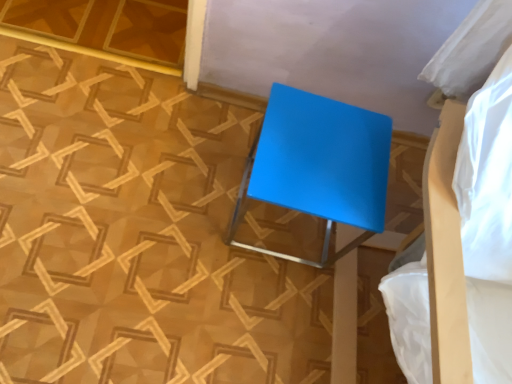
The height and width of the screenshot is (384, 512). Describe the element at coordinates (317, 168) in the screenshot. I see `blue glossy stool at center` at that location.

Locate an element on the screen. blue glossy stool at center is located at coordinates click(x=317, y=168).

This screenshot has height=384, width=512. What do you see at coordinates (484, 177) in the screenshot? I see `matte blue bed at upper right` at bounding box center [484, 177].

In order to click on matte blue bed at upper right in this screenshot , I will do `click(484, 177)`.

You are a GUI agent. You are given a task and a screenshot of the screen. Output one action in this format:
    pyautogui.click(x=<x>, y=<y>)
    Task: Click on the blue glossy stool at center
    The image size is (512, 384).
    Given the screenshot: What is the action you would take?
    pyautogui.click(x=317, y=168)

Would you say matte blue bed at upper right is to the left or to the right of blue glossy stool at center in the picture?

Based on their positions, matte blue bed at upper right is located to the right of blue glossy stool at center.

Looking at this image, is matte blue bed at upper right positioned behind blue glossy stool at center?

No, matte blue bed at upper right is in front of blue glossy stool at center.

Does point (488, 275) appear closer or farther from the camera than point (305, 210)?

Point (488, 275).

From the image's perspective, does matte blue bed at upper right appear lower than blue glossy stool at center?

Yes, from the image's perspective, matte blue bed at upper right is beneath blue glossy stool at center.

From a real-world perspective, is matte blue bed at upper right positioned under blue glossy stool at center based on gravity?

No, from a real-world perspective, matte blue bed at upper right is not under blue glossy stool at center.

Considering the sizes of matte blue bed at upper right and blue glossy stool at center in the image, is matte blue bed at upper right wider or thinner than blue glossy stool at center?

Clearly, matte blue bed at upper right has more width compared to blue glossy stool at center.

From their relative heights in the image, would you say matte blue bed at upper right is taller or shorter than blue glossy stool at center?

In the image, matte blue bed at upper right appears to be taller than blue glossy stool at center.

Looking at the image, does matte blue bed at upper right seem bigger or smaller compared to blue glossy stool at center?

Considering their sizes, matte blue bed at upper right takes up more space than blue glossy stool at center.

Choose the correct answer: Is matte blue bed at upper right inside blue glossy stool at center or outside it?

matte blue bed at upper right exists outside the volume of blue glossy stool at center.

Is matte blue bed at upper right far from blue glossy stool at center?

No, there isn't a large distance between matte blue bed at upper right and blue glossy stool at center.

Is matte blue bed at upper right turned away from blue glossy stool at center?

That's not correct — matte blue bed at upper right is not looking away from blue glossy stool at center.

How many degrees apart are the facing directions of matte blue bed at upper right and blue glossy stool at center?

They differ by 1.98 degrees in their facing directions.

How far apart are matte blue bed at upper right and blue glossy stool at center?

matte blue bed at upper right is 9.59 inches away from blue glossy stool at center.

Image resolution: width=512 pixels, height=384 pixels. In order to click on furniture on the left of the matte blue bed at upper right in this screenshot , I will do `click(317, 168)`.

Considering the relative positions of blue glossy stool at center and matte blue bed at upper right in the image provided, is blue glossy stool at center to the left or to the right of matte blue bed at upper right?

In the image, blue glossy stool at center appears on the left side of matte blue bed at upper right.

Relative to matte blue bed at upper right, is blue glossy stool at center in front or behind?

Clearly, blue glossy stool at center is behind matte blue bed at upper right.

Considering the points (366, 113) and (488, 309), which point is in front, point (366, 113) or point (488, 309)?

Positioned in front is point (488, 309).

From the image's perspective, is blue glossy stool at center located above or below matte blue bed at upper right?

blue glossy stool at center is above matte blue bed at upper right.

From a real-world perspective, is blue glossy stool at center located higher than matte blue bed at upper right?

No.

Considering the sizes of objects blue glossy stool at center and matte blue bed at upper right in the image provided, who is wider, blue glossy stool at center or matte blue bed at upper right?

With larger width is matte blue bed at upper right.

Is blue glossy stool at center shorter than matte blue bed at upper right?

Yes.

Between blue glossy stool at center and matte blue bed at upper right, which one has larger size?

matte blue bed at upper right is bigger.

Do you think blue glossy stool at center is within matte blue bed at upper right, or outside of it?

blue glossy stool at center is outside matte blue bed at upper right.

Can you see blue glossy stool at center touching matte blue bed at upper right?

No, blue glossy stool at center is not beside matte blue bed at upper right.

Is blue glossy stool at center aimed at matte blue bed at upper right?

No.

What's the angular difference between blue glossy stool at center and matte blue bed at upper right's facing directions?

The angular difference between blue glossy stool at center and matte blue bed at upper right is 1.98 degrees.

Where is `bed in front of the blue glossy stool at center`? The image size is (512, 384). bed in front of the blue glossy stool at center is located at coordinates (484, 177).

The width and height of the screenshot is (512, 384). I want to click on bed above the blue glossy stool at center (from a real-world perspective), so click(x=484, y=177).

In the image, there is a matte blue bed at upper right. What are the coordinates of `furniture below it (from a real-world perspective)` in the screenshot? It's located at (317, 168).